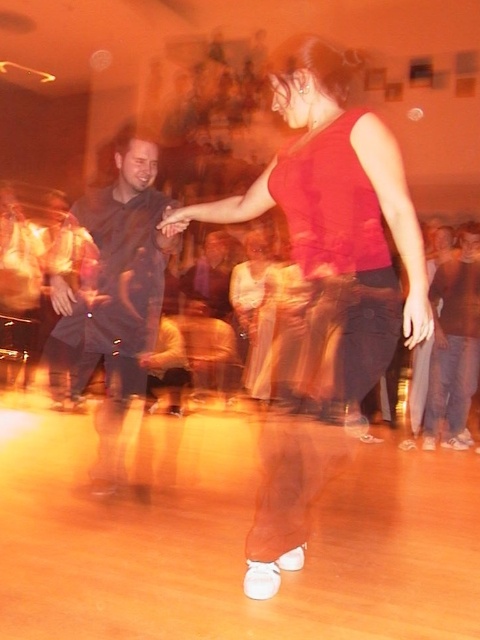
Is point (213, 209) closer to viewer compared to point (455, 380)?

Yes, point (213, 209) is closer to viewer.

Who is positioned more to the right, matte red tank top at center or dark blue jeans at center?

Positioned to the right is dark blue jeans at center.

Identify the location of matte red tank top at center. This screenshot has width=480, height=640. (335, 230).

You are a GUI agent. You are given a task and a screenshot of the screen. Output one action in this format:
    pyautogui.click(x=<x>, y=<y>)
    Task: Click on the matte red tank top at center
    
    Given the screenshot: What is the action you would take?
    pyautogui.click(x=335, y=230)

Which of these two, matte red tank top at center or dark blue fabric shirt at left, stands taller?

Standing taller between the two is matte red tank top at center.

You are a GUI agent. You are given a task and a screenshot of the screen. Output one action in this format:
    pyautogui.click(x=<x>, y=<y>)
    Task: Click on the matte red tank top at center
    
    Given the screenshot: What is the action you would take?
    pyautogui.click(x=335, y=230)

Locate an element on the screen. This screenshot has width=480, height=640. matte red tank top at center is located at coordinates (335, 230).

Who is higher up, dark blue fabric shirt at left or dark blue jeans at center?

dark blue fabric shirt at left

Does dark blue fabric shirt at left have a smaller size compared to dark blue jeans at center?

Incorrect, dark blue fabric shirt at left is not smaller in size than dark blue jeans at center.

Between point (105, 444) and point (478, 227), which one is positioned in front?

Point (105, 444) is in front.

This screenshot has width=480, height=640. I want to click on dark blue fabric shirt at left, so click(x=115, y=296).